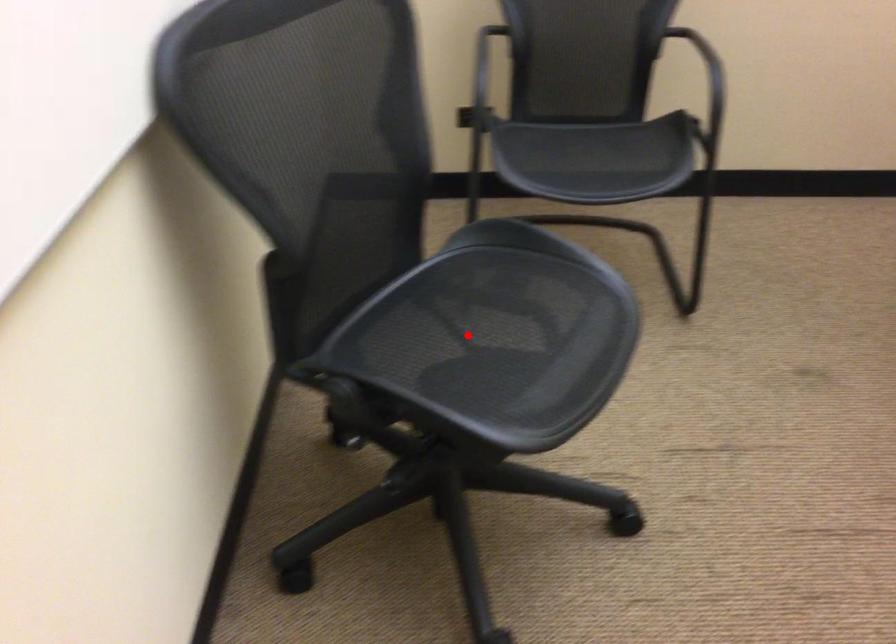
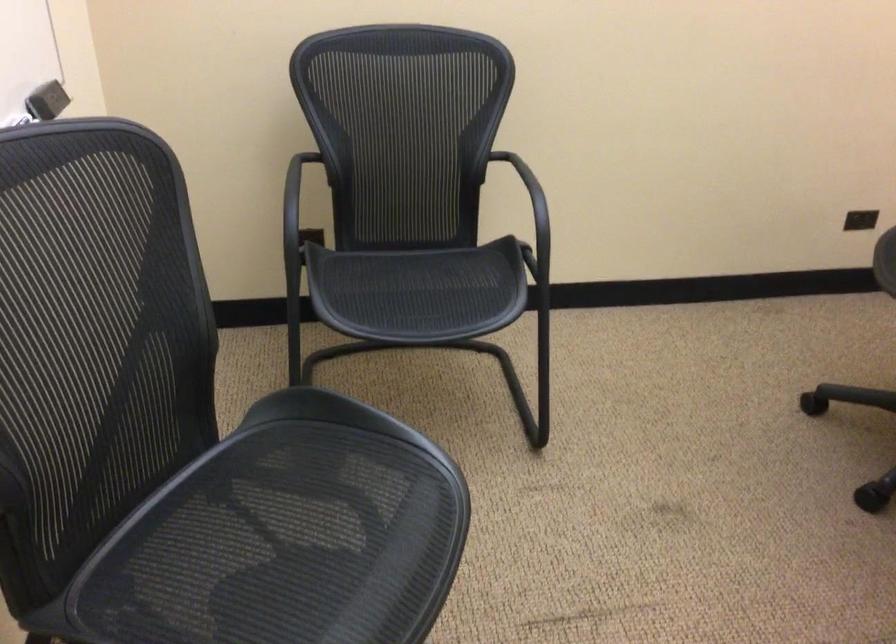
Locate, in the second image, the point that corresponds to the highlighted location in the first image.

(259, 547)